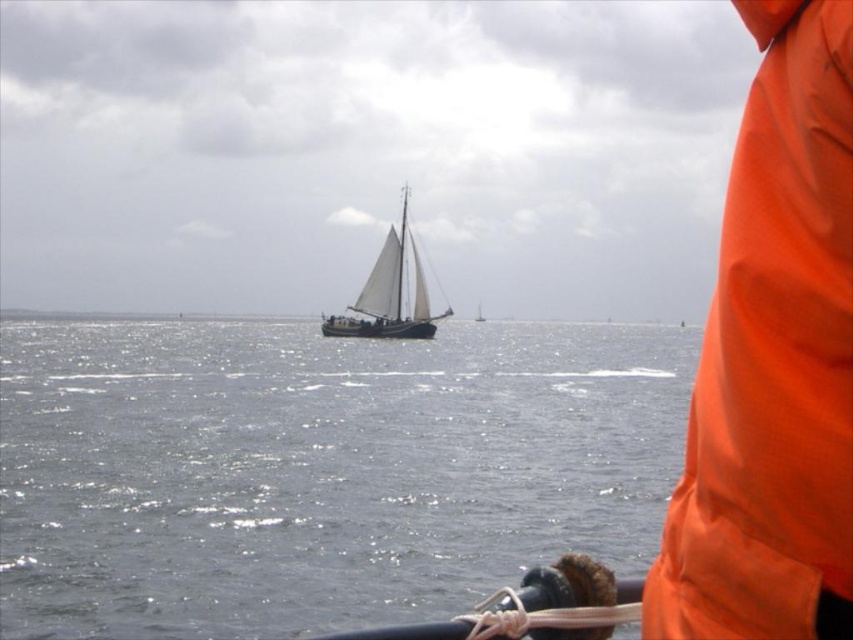
You are a sailor on a boat and need to secure the orange fabric at right. You notice the glistening water at center. Which object is bigger in size?

The glistening water at center is larger in size than the orange fabric at right.